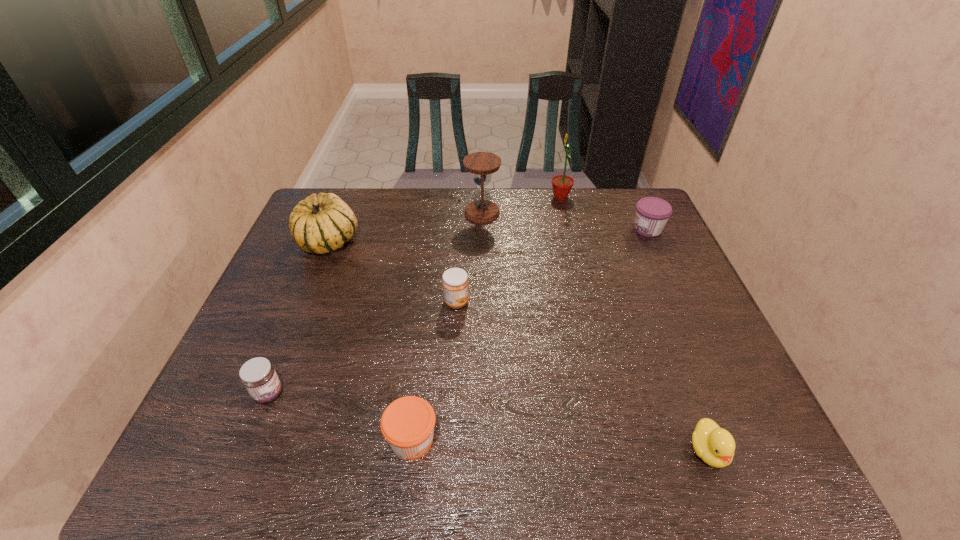
Locate an element on the screen. The image size is (960, 540). the third object from right to left is located at coordinates (562, 184).

Locate an element on the screen. The width and height of the screenshot is (960, 540). sunflower is located at coordinates (562, 184).

At what (x,y) coordinates should I click in order to perform the action: click on hourglass. Please return your answer as a coordinate pair (x, y). This screenshot has width=960, height=540. Looking at the image, I should click on (481, 164).

What are the coordinates of `the sixth shortest object` in the screenshot? It's located at (321, 223).

You are a GUI agent. You are given a task and a screenshot of the screen. Output one action in this format:
    pyautogui.click(x=<x>, y=<y>)
    Task: Click on the fifth farthest object
    This screenshot has height=540, width=960.
    Given the screenshot: What is the action you would take?
    pyautogui.click(x=455, y=283)

What are the coordinates of `the third farthest jam` in the screenshot? It's located at (258, 375).

Identify the location of the sixth farthest object. (258, 375).

At what (x,y) coordinates should I click in order to perform the action: click on the rightmost jam. Please return your answer as a coordinate pair (x, y). This screenshot has height=540, width=960. Looking at the image, I should click on (652, 214).

This screenshot has height=540, width=960. I want to click on the nearest jam, so click(x=407, y=424).

Locate an element on the screen. duckling is located at coordinates (715, 446).